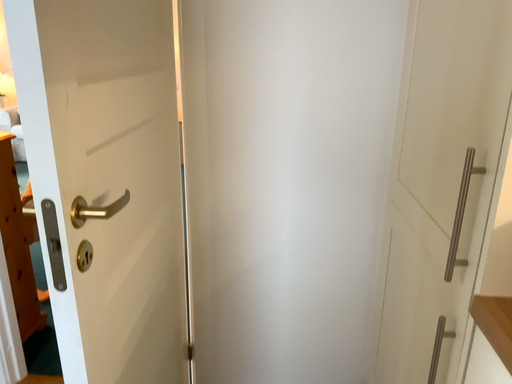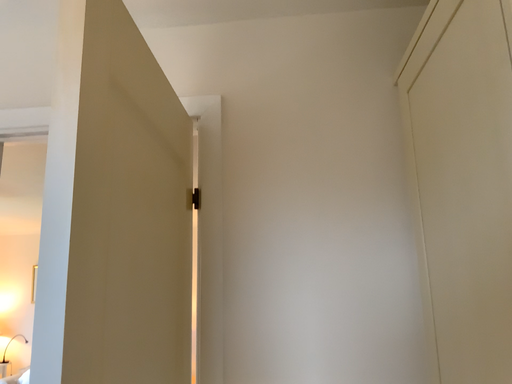
Question: How did the camera likely rotate when shooting the video?

Choices:
 (A) rotated upward
 (B) rotated downward

Answer: (A)